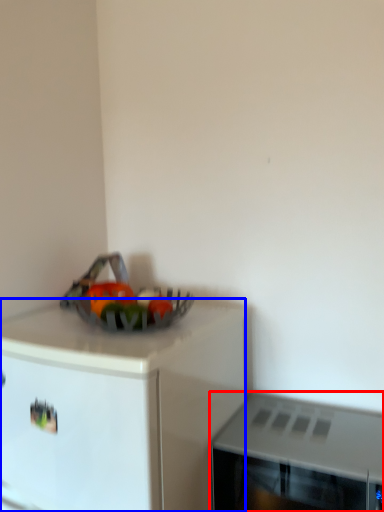
Question: Which of the following is the farthest to the observer, microwave oven (highlighted by a red box) or cabinetry (highlighted by a blue box)?

Choices:
 (A) microwave oven
 (B) cabinetry

Answer: (A)